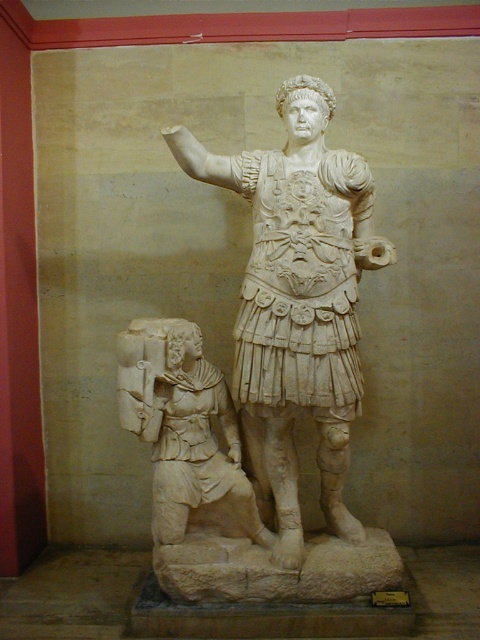
Is white marble statue at center wider than white marble figure at lower left?

Yes, white marble statue at center is wider than white marble figure at lower left.

Between point (254, 376) and point (135, 378), which one is positioned in front?

Point (135, 378)

The width and height of the screenshot is (480, 640). What are the coordinates of `white marble statue at center` in the screenshot? It's located at (298, 301).